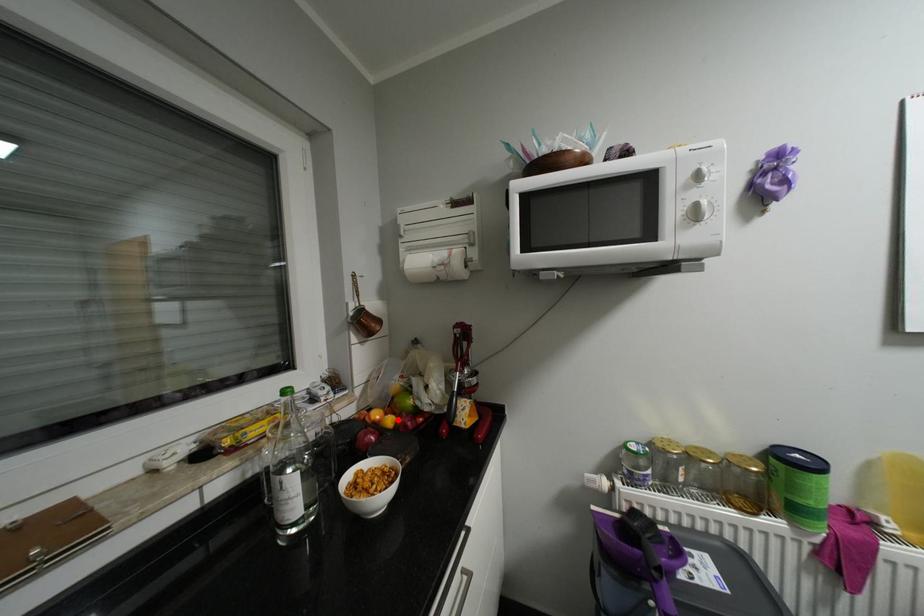
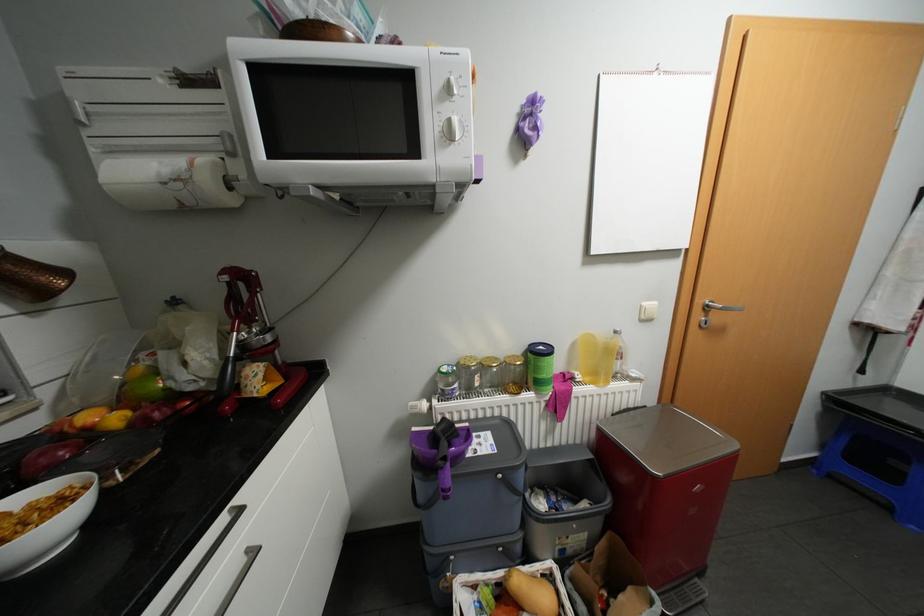
Question: I am providing you with two images of the same scene from different viewpoints. A red point is marked on the first image. At the location where the point appears in image 1, is it still visible in image 2?

Choices:
 (A) Yes
 (B) No

Answer: (A)